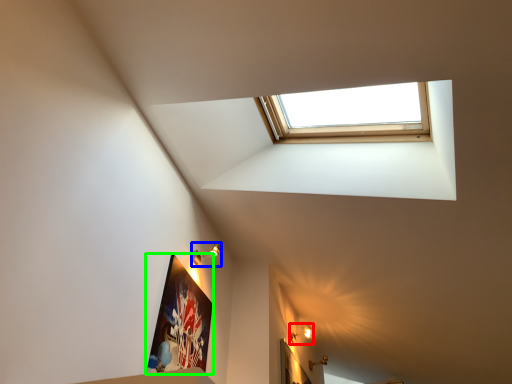
Question: Considering the real-world distances, which object is closest to light fixture (highlighted by a red box)? light fixture (highlighted by a blue box) or picture frame (highlighted by a green box).

Choices:
 (A) light fixture
 (B) picture frame

Answer: (A)